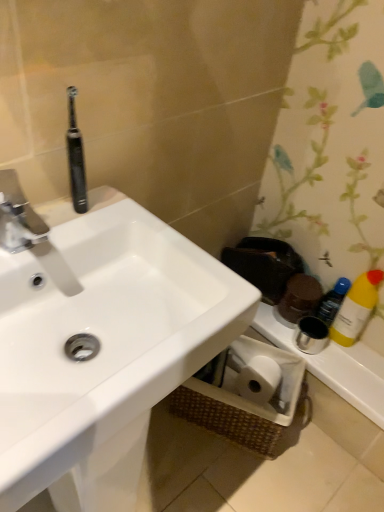
Question: Considering the relative sizes of white plastic toilet paper holder at lower right and black rubber toothbrush at upper left in the image provided, is white plastic toilet paper holder at lower right taller than black rubber toothbrush at upper left?

Choices:
 (A) yes
 (B) no

Answer: (B)

Question: Does white plastic toilet paper holder at lower right have a smaller size compared to black rubber toothbrush at upper left?

Choices:
 (A) yes
 (B) no

Answer: (B)

Question: Is white plastic toilet paper holder at lower right not inside black rubber toothbrush at upper left?

Choices:
 (A) no
 (B) yes

Answer: (B)

Question: From a real-world perspective, is white plastic toilet paper holder at lower right over black rubber toothbrush at upper left?

Choices:
 (A) yes
 (B) no

Answer: (B)

Question: Is white plastic toilet paper holder at lower right bigger than black rubber toothbrush at upper left?

Choices:
 (A) yes
 (B) no

Answer: (A)

Question: Is white plastic toilet paper holder at lower right thinner than black rubber toothbrush at upper left?

Choices:
 (A) yes
 (B) no

Answer: (B)

Question: Is black rubber toothbrush at upper left thinner than yellow plastic bottle at right?

Choices:
 (A) yes
 (B) no

Answer: (A)

Question: Is black rubber toothbrush at upper left not near yellow plastic bottle at right?

Choices:
 (A) no
 (B) yes

Answer: (A)

Question: Is black rubber toothbrush at upper left facing towards yellow plastic bottle at right?

Choices:
 (A) no
 (B) yes

Answer: (A)

Question: Is black rubber toothbrush at upper left wider than yellow plastic bottle at right?

Choices:
 (A) no
 (B) yes

Answer: (A)

Question: From a real-world perspective, is black rubber toothbrush at upper left beneath yellow plastic bottle at right?

Choices:
 (A) no
 (B) yes

Answer: (A)

Question: Is black rubber toothbrush at upper left behind yellow plastic bottle at right?

Choices:
 (A) yes
 (B) no

Answer: (B)

Question: Does white glossy sink at upper left lie behind black rubber toothbrush at upper left?

Choices:
 (A) yes
 (B) no

Answer: (B)